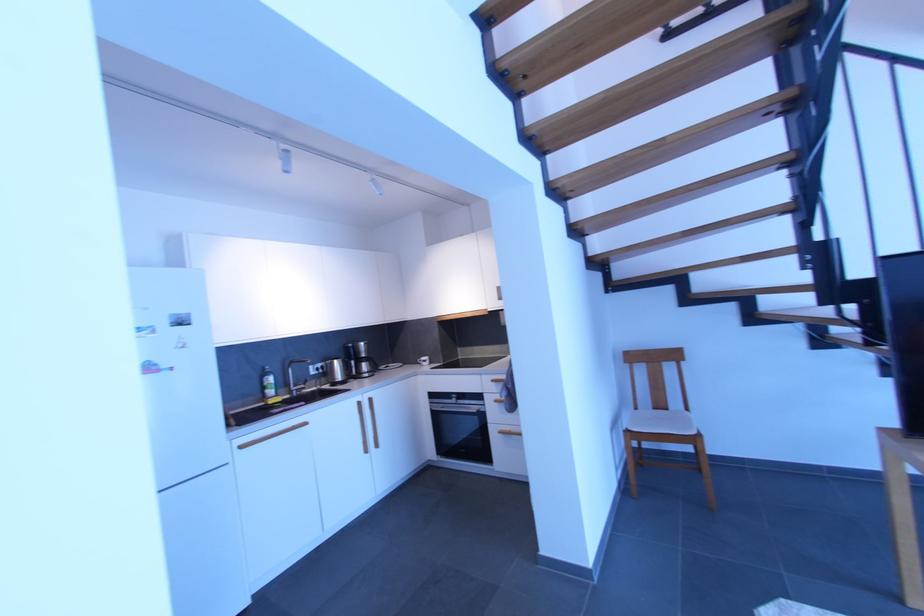
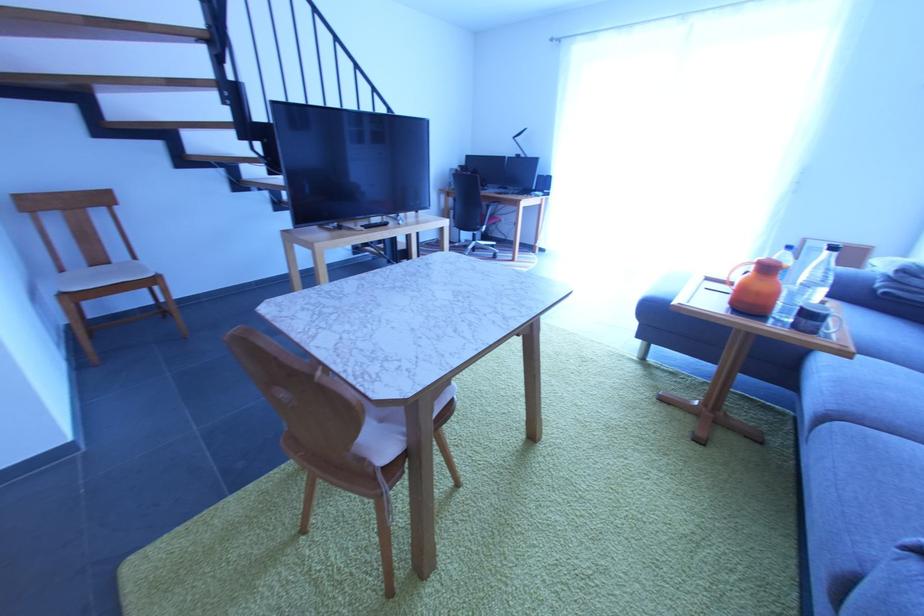
Locate, in the second image, the point that corresponds to (x=659, y=411) in the first image.

(96, 268)